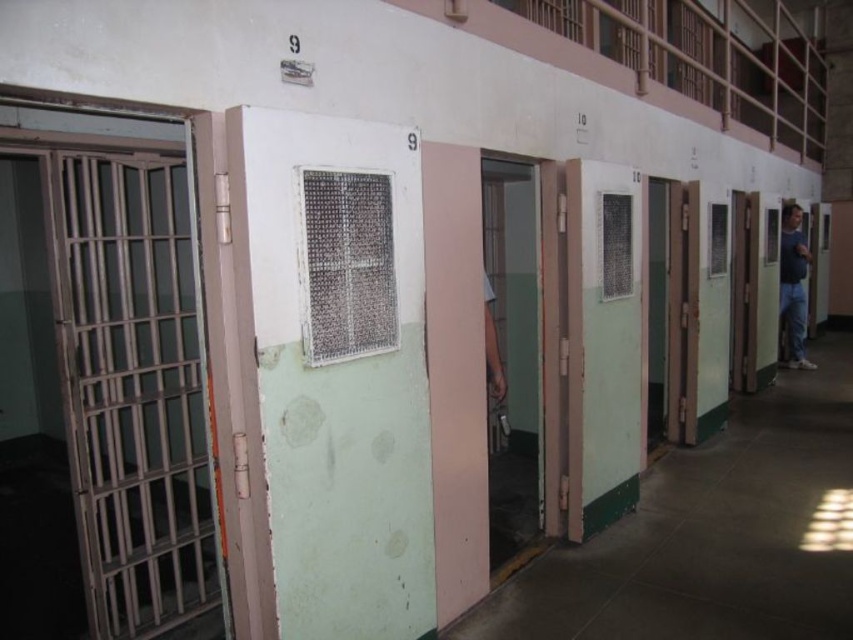
Question: Which of the following is the closest to the observer?

Choices:
 (A) blue jeans at right
 (B) green matte door at center

Answer: (B)

Question: Does green matte door at center lie in front of blue jeans at right?

Choices:
 (A) no
 (B) yes

Answer: (B)

Question: Does green matte door at center have a larger size compared to blue jeans at right?

Choices:
 (A) no
 (B) yes

Answer: (B)

Question: Can you confirm if green matte door at center is positioned to the left of blue jeans at right?

Choices:
 (A) yes
 (B) no

Answer: (A)